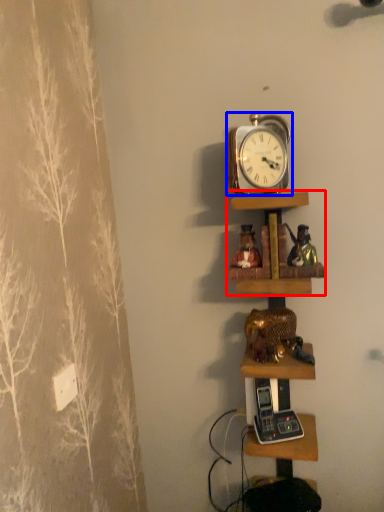
Question: Which object appears closest to the camera in this image, shelf (highlighted by a red box) or alarm clock (highlighted by a blue box)?

Choices:
 (A) shelf
 (B) alarm clock

Answer: (B)